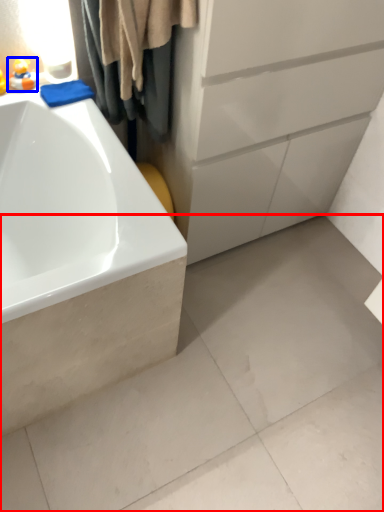
Question: Among these objects, which one is farthest to the camera, concrete (highlighted by a red box) or toy (highlighted by a blue box)?

Choices:
 (A) concrete
 (B) toy

Answer: (B)